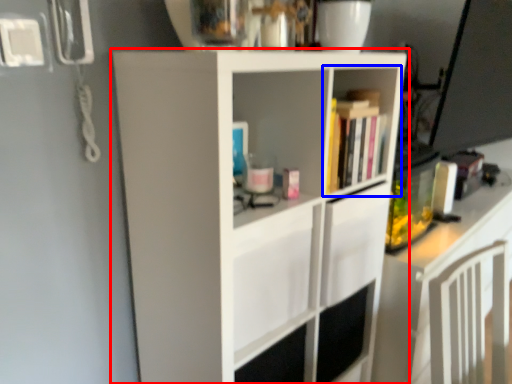
Question: Among these objects, which one is nearest to the camera, cupboard (highlighted by a red box) or shelf (highlighted by a blue box)?

Choices:
 (A) cupboard
 (B) shelf

Answer: (A)